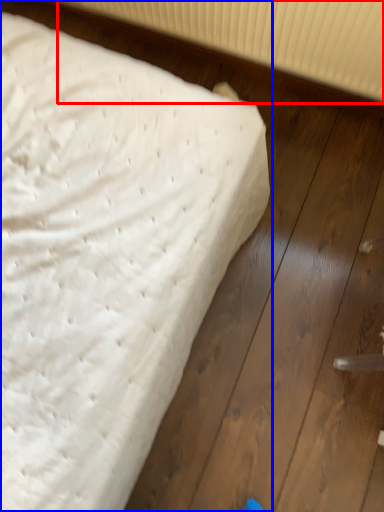
Question: Which of the following is the closest to the observer, radiator (highlighted by a red box) or bed (highlighted by a blue box)?

Choices:
 (A) radiator
 (B) bed

Answer: (B)